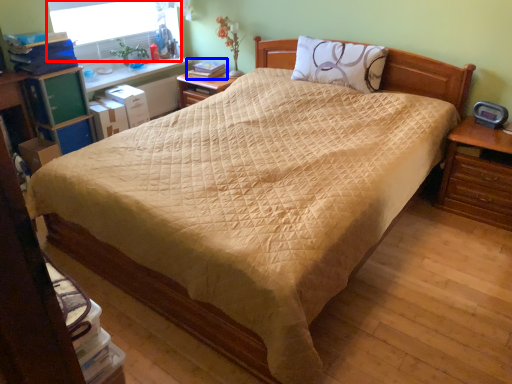
Question: Which of the following is the closest to the observer, window screen (highlighted by a red box) or book (highlighted by a blue box)?

Choices:
 (A) window screen
 (B) book

Answer: (A)